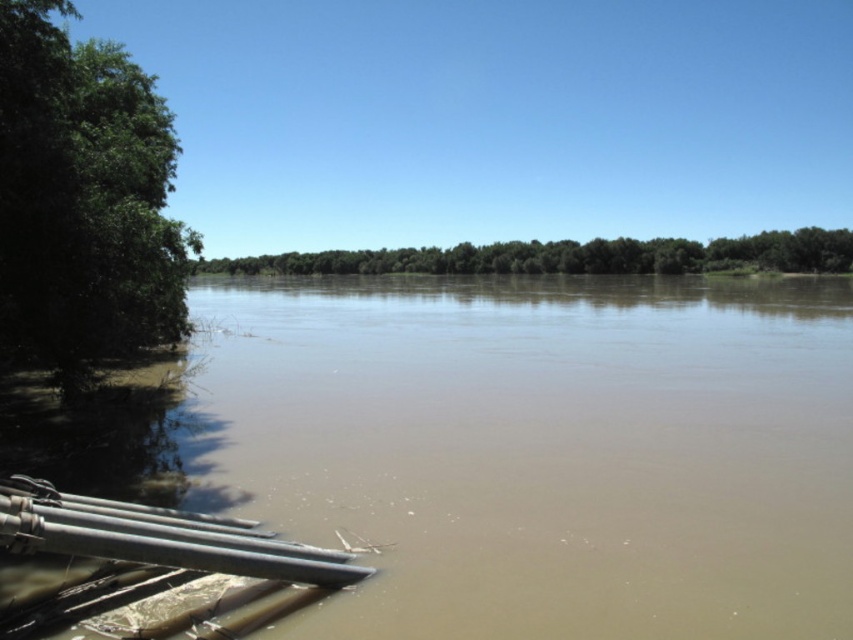
Question: Which point appears closest to the camera in this image?

Choices:
 (A) (193, 531)
 (B) (434, 269)
 (C) (103, 74)

Answer: (A)

Question: Which of the following is the closest to the observer?

Choices:
 (A) green leafy tree at left
 (B) matte gray water pipe at lower left
 (C) brown muddy water at lower left
 (D) green leafy trees at center

Answer: (B)

Question: Does green leafy tree at left appear on the right side of matte gray water pipe at lower left?

Choices:
 (A) yes
 (B) no

Answer: (B)

Question: Does brown muddy water at lower left appear over green leafy trees at center?

Choices:
 (A) no
 (B) yes

Answer: (A)

Question: Among these objects, which one is nearest to the camera?

Choices:
 (A) green leafy trees at center
 (B) green leafy tree at left
 (C) brown muddy water at lower left
 (D) matte gray water pipe at lower left

Answer: (D)

Question: Is brown muddy water at lower left wider than green leafy tree at left?

Choices:
 (A) yes
 (B) no

Answer: (A)